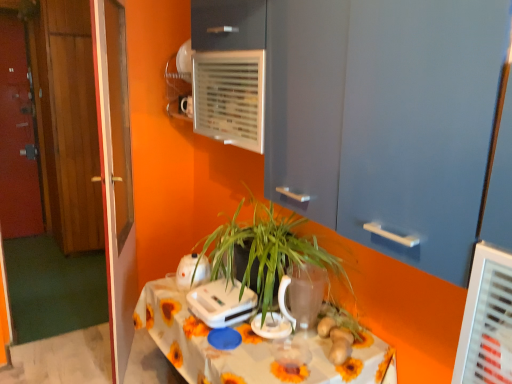
Question: Would you say brown matte ginger at center is outside white plastic air conditioning unit at upper center?

Choices:
 (A) no
 (B) yes

Answer: (B)

Question: Considering the relative positions of brown matte ginger at center and white plastic air conditioning unit at upper center in the image provided, is brown matte ginger at center behind white plastic air conditioning unit at upper center?

Choices:
 (A) no
 (B) yes

Answer: (A)

Question: From the image's perspective, does brown matte ginger at center appear lower than white plastic air conditioning unit at upper center?

Choices:
 (A) yes
 (B) no

Answer: (A)

Question: Is brown matte ginger at center bigger than white plastic air conditioning unit at upper center?

Choices:
 (A) no
 (B) yes

Answer: (A)

Question: Considering the relative positions of brown matte ginger at center and white plastic air conditioning unit at upper center in the image provided, is brown matte ginger at center to the right of white plastic air conditioning unit at upper center from the viewer's perspective?

Choices:
 (A) no
 (B) yes

Answer: (B)

Question: Could you tell me if brown matte ginger at center is facing white plastic air conditioning unit at upper center?

Choices:
 (A) no
 (B) yes

Answer: (A)

Question: From a real-world perspective, is white plastic appliance at center, the second appliance from the left, over white plastic toaster at center, which is counted as the third appliance, starting from the right?

Choices:
 (A) yes
 (B) no

Answer: (B)

Question: Is white plastic toaster at center, the 1th appliance from the left, completely or partially inside white plastic appliance at center, the second appliance from the left?

Choices:
 (A) no
 (B) yes

Answer: (A)

Question: Can you confirm if white plastic appliance at center, the second appliance from the left, is taller than white plastic toaster at center, the 1th appliance from the left?

Choices:
 (A) yes
 (B) no

Answer: (B)

Question: From the image's perspective, would you say white plastic appliance at center, the 2th appliance positioned from the right, is positioned over white plastic toaster at center, the 1th appliance from the left?

Choices:
 (A) yes
 (B) no

Answer: (B)

Question: Is white plastic appliance at center, the 2th appliance positioned from the right, next to white plastic toaster at center, the 1th appliance from the left, and touching it?

Choices:
 (A) yes
 (B) no

Answer: (B)

Question: Is white plastic appliance at center, the second appliance from the left, bigger than white plastic toaster at center, the 1th appliance from the left?

Choices:
 (A) yes
 (B) no

Answer: (A)

Question: Is wooden door at left, placed as the third door when sorted from back to front, looking in the opposite direction of white plastic appliance at center, the second appliance from the left?

Choices:
 (A) no
 (B) yes

Answer: (A)